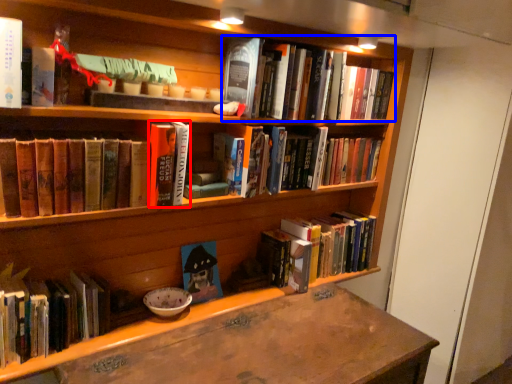
Question: Among these objects, which one is farthest to the camera, book (highlighted by a red box) or book (highlighted by a blue box)?

Choices:
 (A) book
 (B) book

Answer: (B)